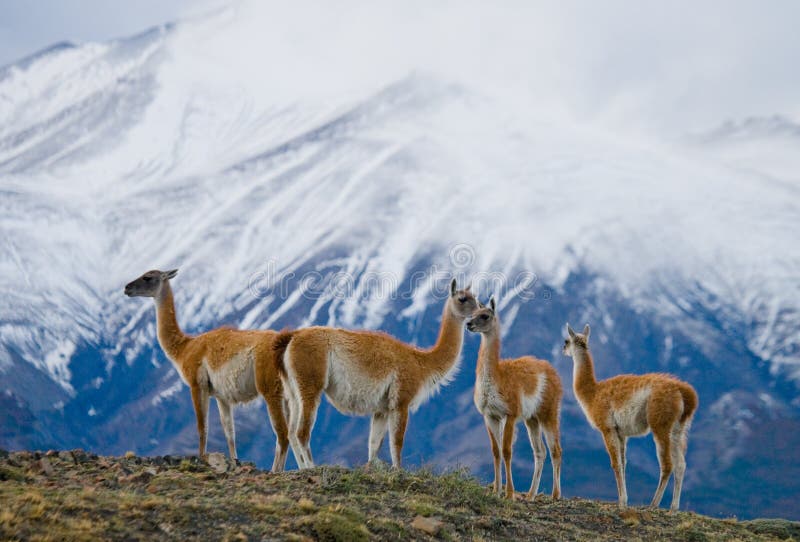
Where is `white fur`? The width and height of the screenshot is (800, 542). white fur is located at coordinates (489, 398), (528, 404), (626, 419), (358, 397), (236, 382).